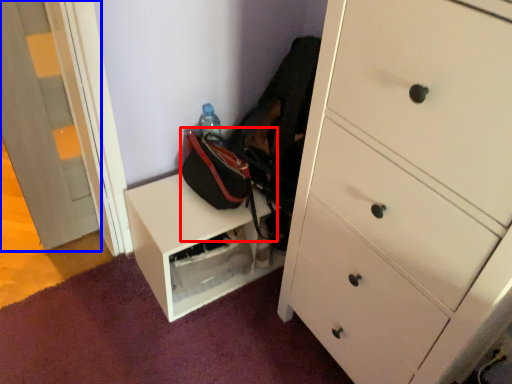
Question: Which object is further to the camera taking this photo, messenger bag (highlighted by a red box) or door (highlighted by a blue box)?

Choices:
 (A) messenger bag
 (B) door

Answer: (A)